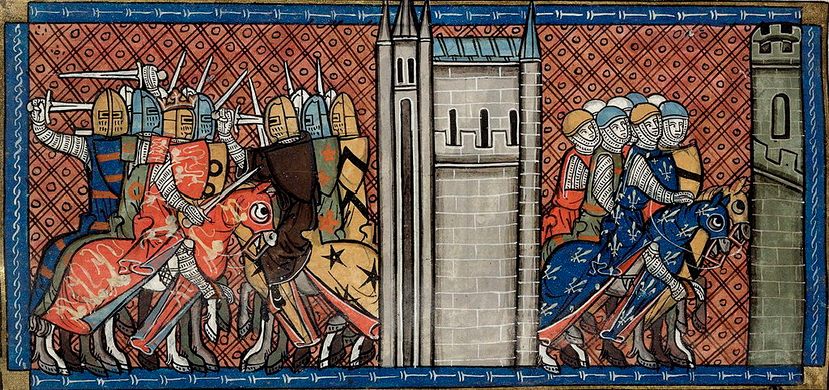
The width and height of the screenshot is (829, 390). Identify the location of window. (778, 115).